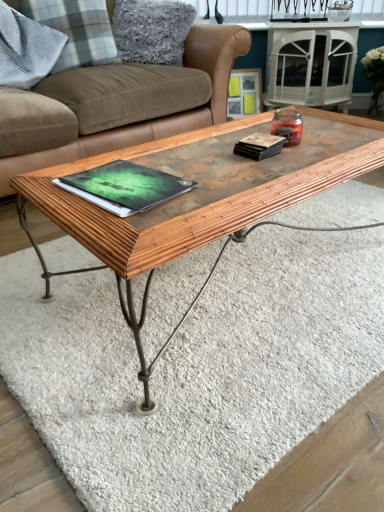
The height and width of the screenshot is (512, 384). In order to click on unoccupied area in front of matte black book at upper right, acting as the second book starting from the left in this screenshot , I will do `click(270, 172)`.